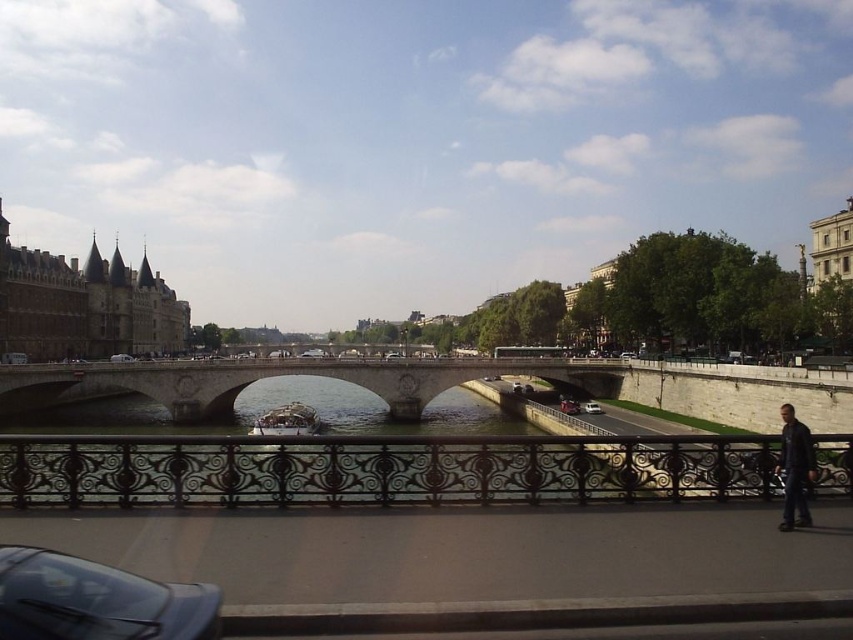
You are a tour guide leading a group at the stone bridge. You want to show them both the metallic silver boat at center and the white matte van at center. Can you see both objects at the same time from your current position?

The metallic silver boat at center and white matte van at center are 48.29 meters apart, so yes, you can see both objects at the same time from your current position.

You are standing at the center of the stone bridge and want to reach the point marked at coordinates point [314,353]. Given that the bridge is 200 meters long, will you have to walk beyond the bridge to reach that point?

The point marked at coordinates point [314,353] is 257.31 meters away from the viewer. Since the bridge is only 200 meters long, you will have to walk beyond the bridge to reach that point.

You are a tourist standing on the stone bridge at center and want to take a photo of the black wrought iron railing at center. Based on their heights, which object should you look up to or down to focus on?

The black wrought iron railing at center is not as tall as the stone bridge at center, so you should look down to focus on the black wrought iron railing at center.